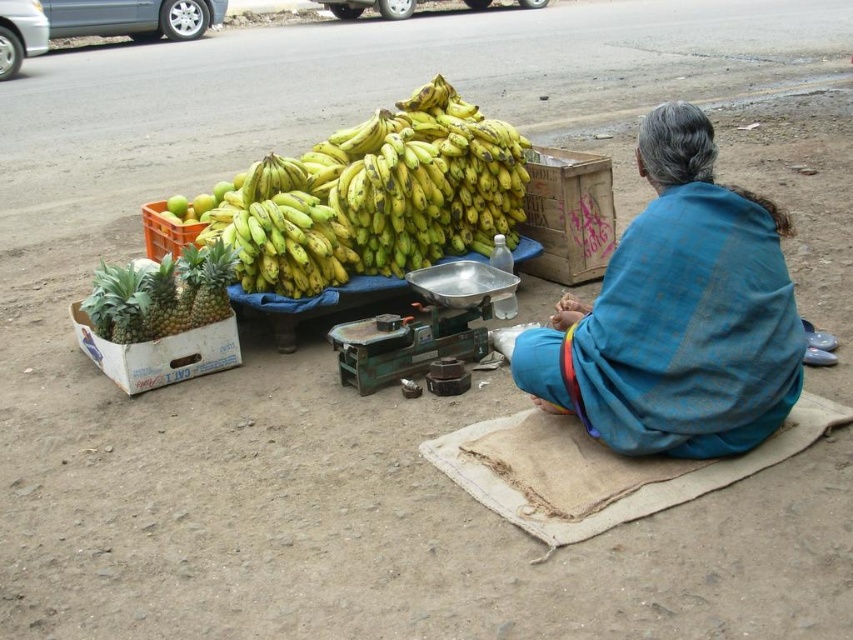
Does point (566, 308) come farther from viewer compared to point (409, 348)?

No, it is in front of (409, 348).

Is blue fabric shawl at center taller than metallic scale at center?

Indeed, blue fabric shawl at center has a greater height compared to metallic scale at center.

This screenshot has height=640, width=853. What do you see at coordinates (677, 314) in the screenshot?
I see `blue fabric shawl at center` at bounding box center [677, 314].

Where is `blue fabric shawl at center`? This screenshot has width=853, height=640. blue fabric shawl at center is located at coordinates (677, 314).

Is metallic scale at center to the left of green matte pineapple at left from the viewer's perspective?

No, metallic scale at center is not to the left of green matte pineapple at left.

This screenshot has height=640, width=853. What are the coordinates of `metallic scale at center` in the screenshot? It's located at (422, 324).

Can you confirm if yellow matte bananas at center is shorter than metallic scale at center?

No.

Can you confirm if yellow matte bananas at center is thinner than metallic scale at center?

Incorrect, yellow matte bananas at center's width is not less than metallic scale at center's.

Which is in front, point (248, 182) or point (387, 362)?

Positioned in front is point (387, 362).

The width and height of the screenshot is (853, 640). What are the coordinates of `yellow matte bananas at center` in the screenshot? It's located at (390, 189).